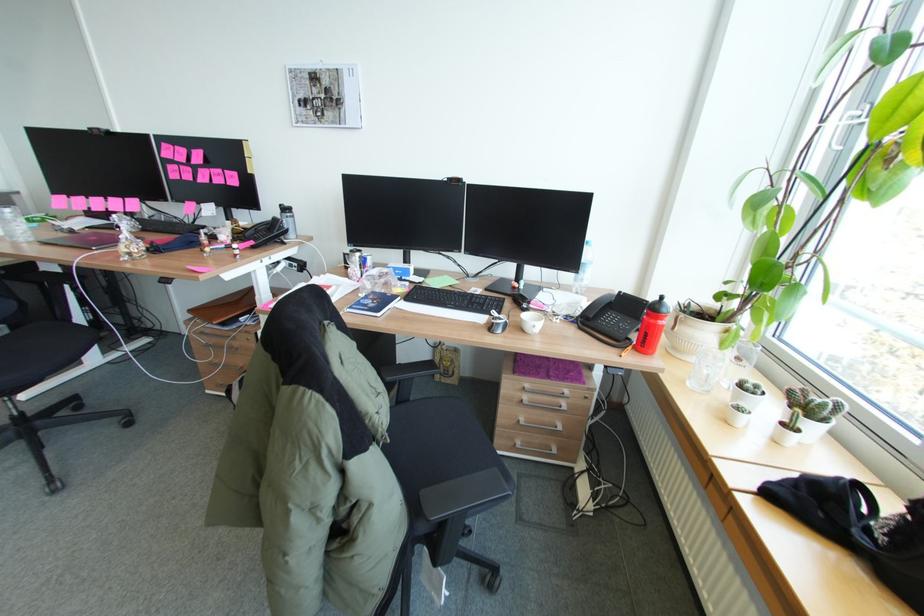
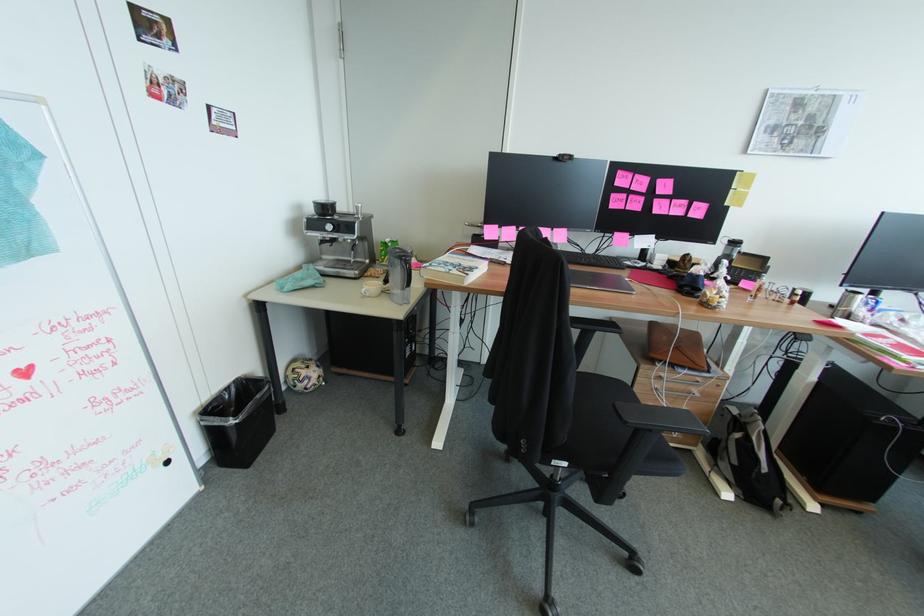
Question: Which direction would the cameraman need to move to produce the second image? Reply with the corresponding letter.

Choices:
 (A) Left
 (B) Right
 (C) Forward
 (D) Backward

Answer: (A)